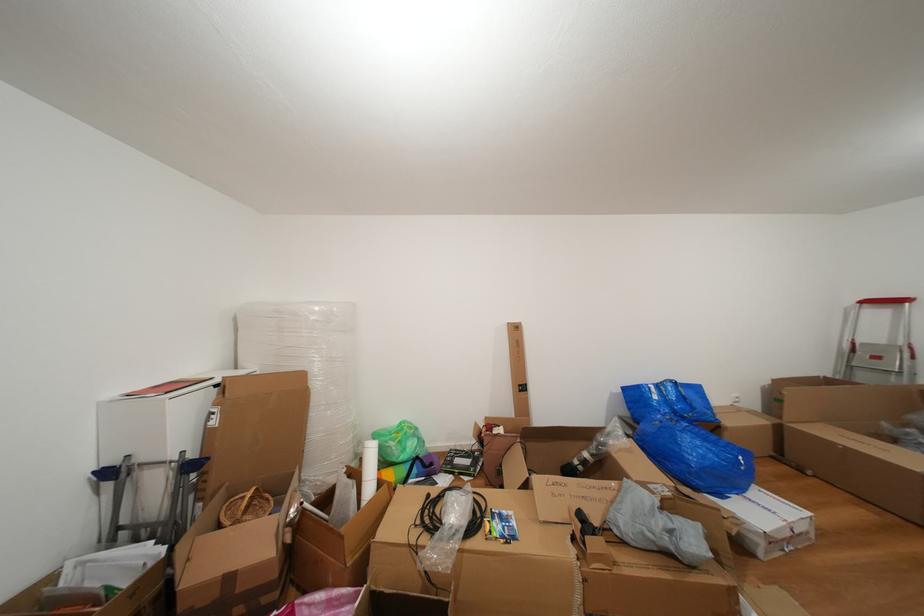
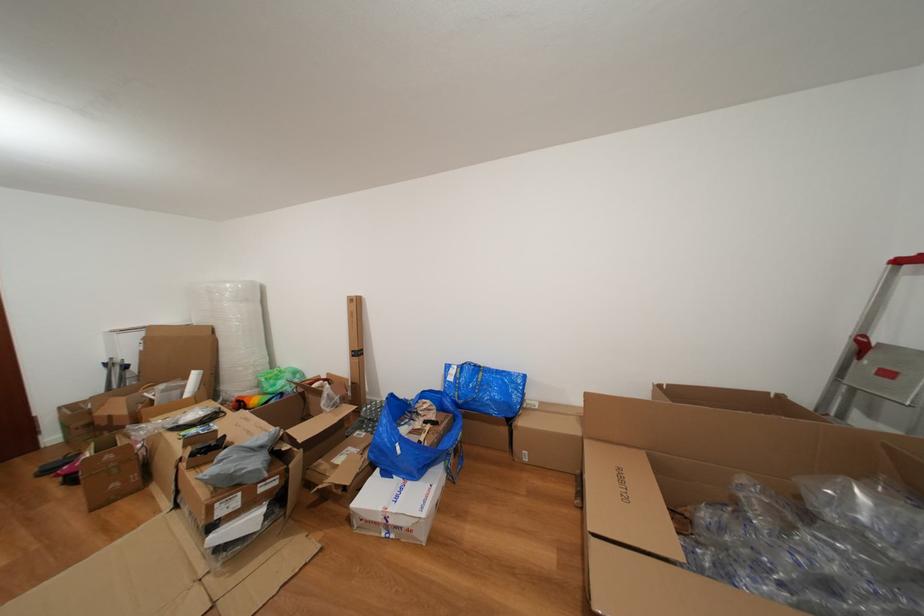
Locate, in the second image, the point that corresponds to pixel 663 402 in the first image.

(458, 384)